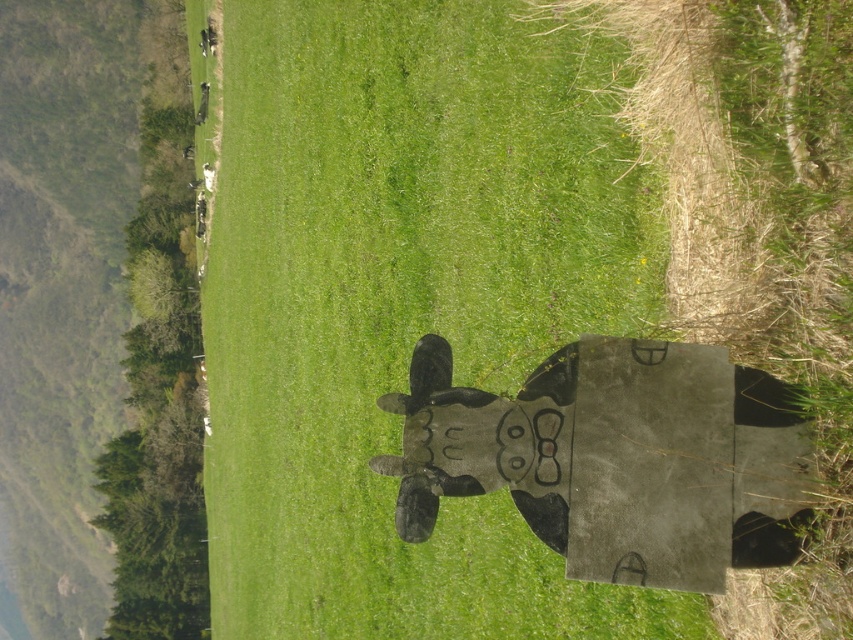
You are a farmer who wants to place a new wooden cow at center in your field. You already have a black matte cow at center. If you want to keep both cows, which one should you move to make space, and why?

You should move the wooden cow at center because it is wider than the black matte cow at center, so moving the larger one would create more space for both.